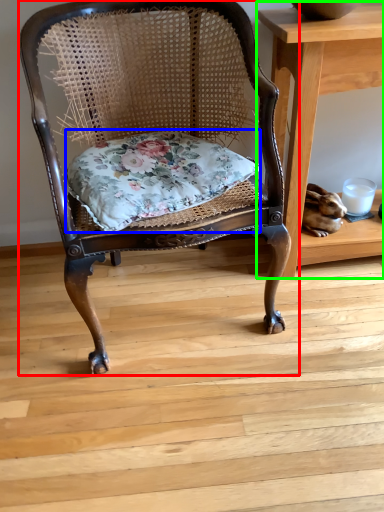
Question: Which object is positioned closest to chair (highlighted by a red box)? Select from pillow (highlighted by a blue box) and table (highlighted by a green box).

Choices:
 (A) pillow
 (B) table

Answer: (A)